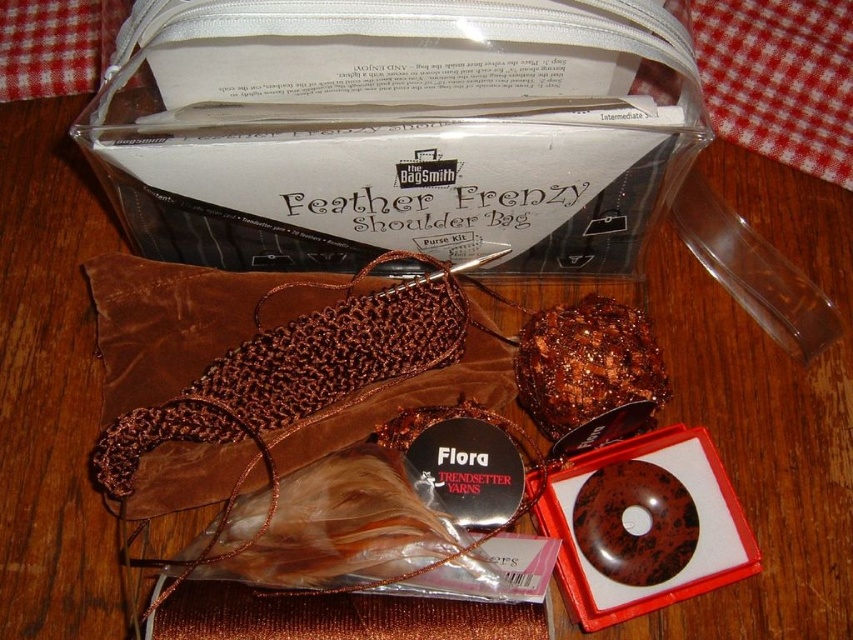
Is matte brown yarn at upper center further to camera compared to shiny brown chocolate cake at center?

That is False.

Between matte brown yarn at upper center and shiny brown chocolate cake at center, which one appears on the right side from the viewer's perspective?

shiny brown chocolate cake at center

Which is behind, point (163, 13) or point (527, 353)?

Point (527, 353)

This screenshot has height=640, width=853. I want to click on matte brown yarn at upper center, so click(395, 131).